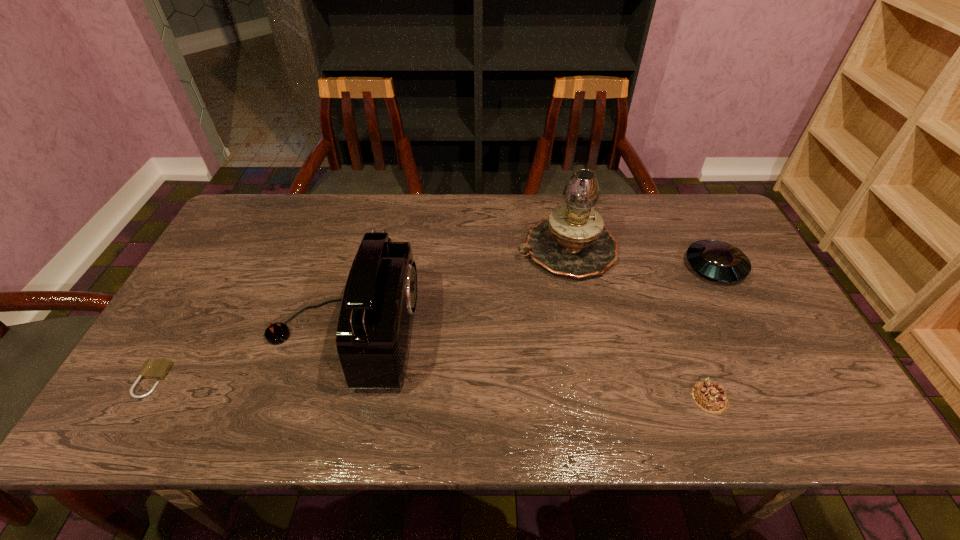
In the image, there is a desktop. Identify the location of vacant area at the near edge. (214, 434).

Where is `vacant space at the right edge of the desktop`? Image resolution: width=960 pixels, height=540 pixels. vacant space at the right edge of the desktop is located at coordinates (806, 396).

Find the location of `free spot between the fourth object from right to left and the rightmost object`. free spot between the fourth object from right to left and the rightmost object is located at coordinates (529, 300).

Locate an element on the screen. vacant space that is in between the shortest object and the saucer is located at coordinates (433, 323).

In order to click on vacant area that lies between the saucer and the third object from left to right in this screenshot , I will do point(641,258).

Find the location of a particular element. free space between the leftmost object and the third shortest object is located at coordinates (433, 323).

I want to click on vacant region between the third object from right to left and the chocolate cake, so click(638, 324).

Locate an element on the screen. This screenshot has width=960, height=540. vacant space that's between the second object from left to right and the saucer is located at coordinates (529, 300).

The width and height of the screenshot is (960, 540). In order to click on empty space between the leftmost object and the fourth object from left to right in this screenshot , I will do pos(431,389).

I want to click on free spot between the rightmost object and the leftmost object, so click(433, 323).